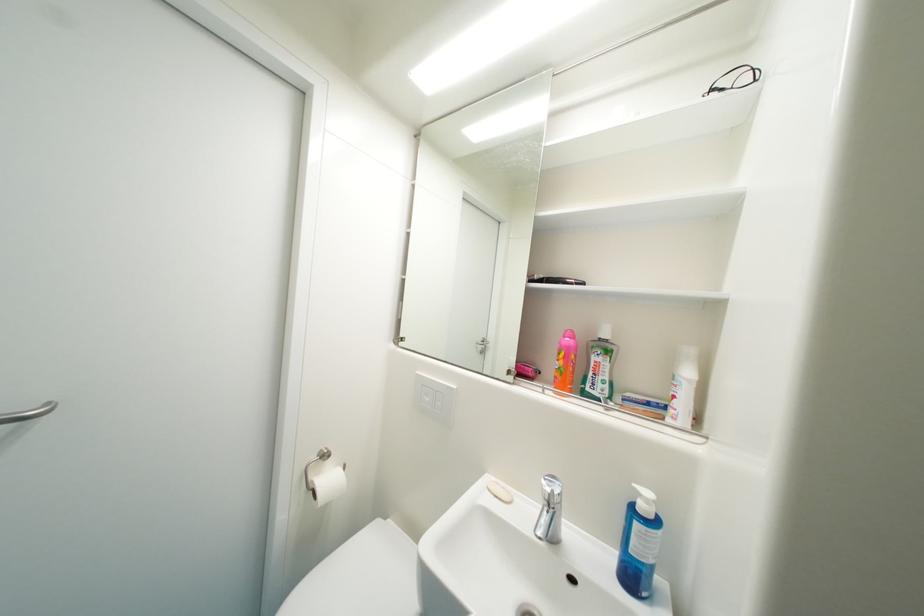
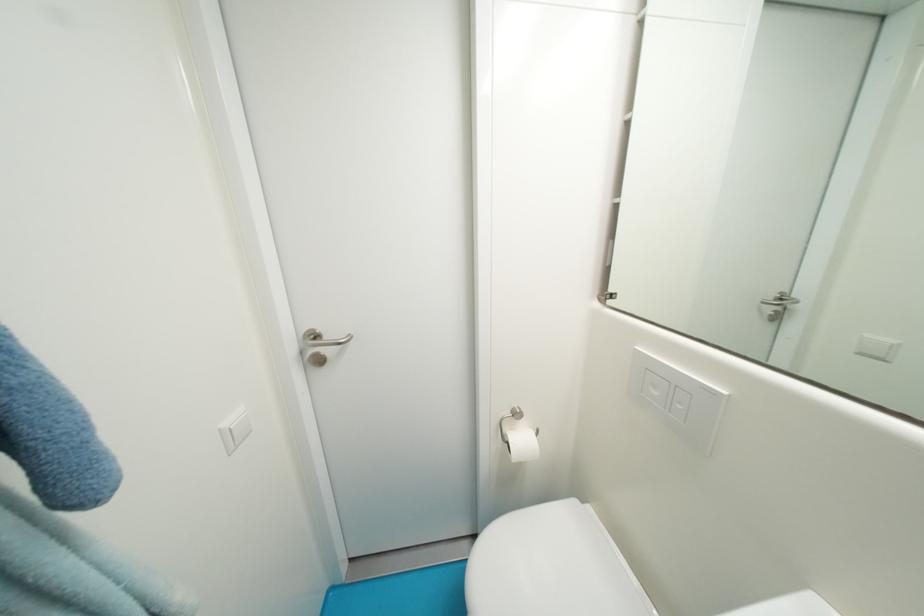
Locate, in the second image, the point that corresponds to [337,482] in the first image.

(529, 442)